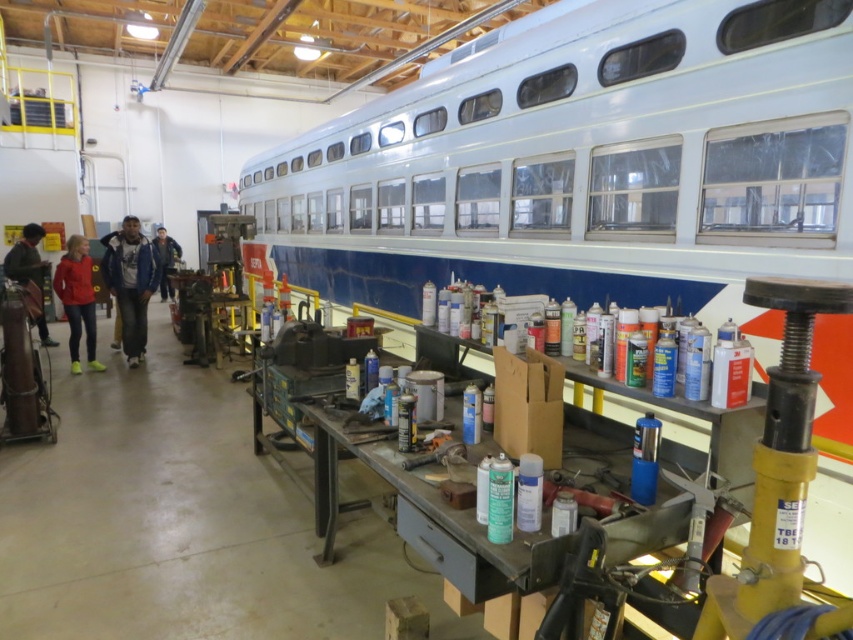
Looking at this image, you are a worker in the workshop and need to decide which item to move first. Since you can only move one item at a time, which one is shorter and easier to handle? Please choose between the matte red jacket at center and the blue jeans at center.

The matte red jacket at center is not as tall as blue jeans at center, so it is shorter and easier to handle. Choose the matte red jacket at center first.

Looking at this image, you are an apprentice mechanic in the workshop. You need to find a place to put your matte black jacket at left and blue jeans at center. Which item requires a larger space to store?

The blue jeans at center requires a larger space to store because the matte black jacket at left is smaller than blue jeans at center.